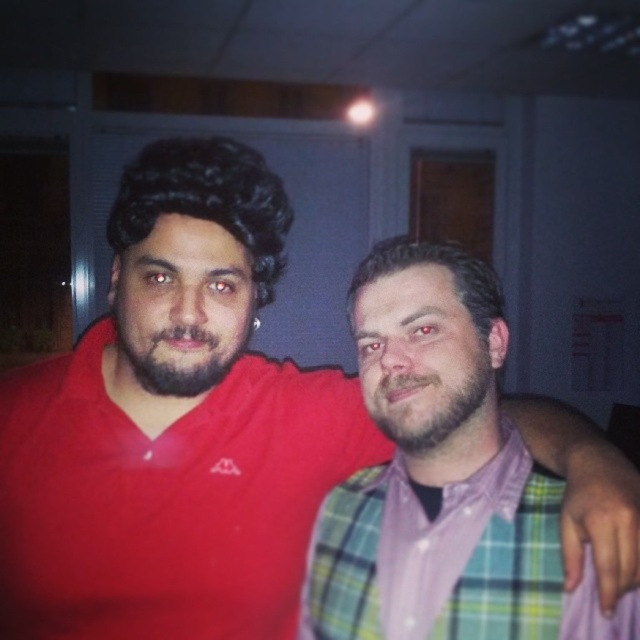
Is dark brown fuzzy beard at center thinner than brownwoollybeard at center?

Incorrect, dark brown fuzzy beard at center's width is not less than brownwoollybeard at center's.

Does dark brown fuzzy beard at center lie in front of brownwoollybeard at center?

Yes, dark brown fuzzy beard at center is closer to the viewer.

Describe the element at coordinates (180, 349) in the screenshot. I see `dark brown fuzzy beard at center` at that location.

I want to click on dark brown fuzzy beard at center, so click(180, 349).

Does plaid fabric shirt at center come behind dark brown fuzzy beard at center?

No, plaid fabric shirt at center is in front of dark brown fuzzy beard at center.

Is plaid fabric shirt at center to the left of dark brown fuzzy beard at center from the viewer's perspective?

No, plaid fabric shirt at center is not to the left of dark brown fuzzy beard at center.

Is point (412, 596) farther from viewer compared to point (221, 376)?

That is False.

Identify the location of plaid fabric shirt at center. The height and width of the screenshot is (640, 640). (449, 560).

Describe the element at coordinates (449, 560) in the screenshot. I see `plaid fabric shirt at center` at that location.

This screenshot has width=640, height=640. I want to click on plaid fabric shirt at center, so click(x=449, y=560).